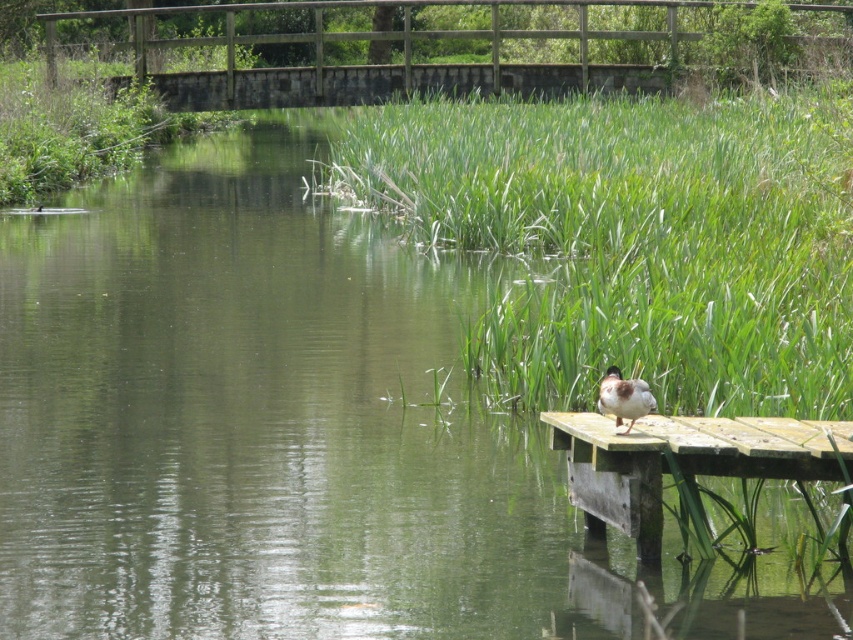
Question: Estimate the real-world distances between objects in this image. Which object is farther from the brown feathered duck at right?

Choices:
 (A) green grass at lower right
 (B) weathered wood dock at right

Answer: (A)

Question: Is the position of green grass at lower right less distant than that of weathered wood dock at right?

Choices:
 (A) no
 (B) yes

Answer: (A)

Question: Can you confirm if green grass at lower right is wider than weathered wood dock at right?

Choices:
 (A) yes
 (B) no

Answer: (A)

Question: Which of the following is the farthest from the observer?

Choices:
 (A) green grass at lower right
 (B) weathered wood dock at right
 (C) brown feathered duck at right

Answer: (A)

Question: Can you confirm if green grass at lower right is wider than brown feathered duck at right?

Choices:
 (A) no
 (B) yes

Answer: (B)

Question: Which point is closer to the camera?

Choices:
 (A) green grass at lower right
 (B) brown feathered duck at right

Answer: (B)